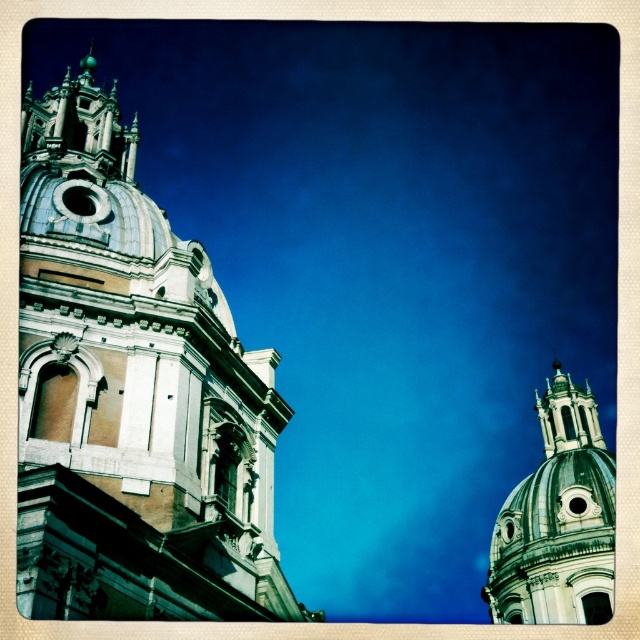
Who is taller, white stone church at left or white marble dome at upper right?

white stone church at left

Is point (177, 355) positioned before point (545, 541)?

Yes, it is in front of point (545, 541).

Describe the element at coordinates (132, 394) in the screenshot. I see `white stone church at left` at that location.

Identify the location of white stone church at left. (132, 394).